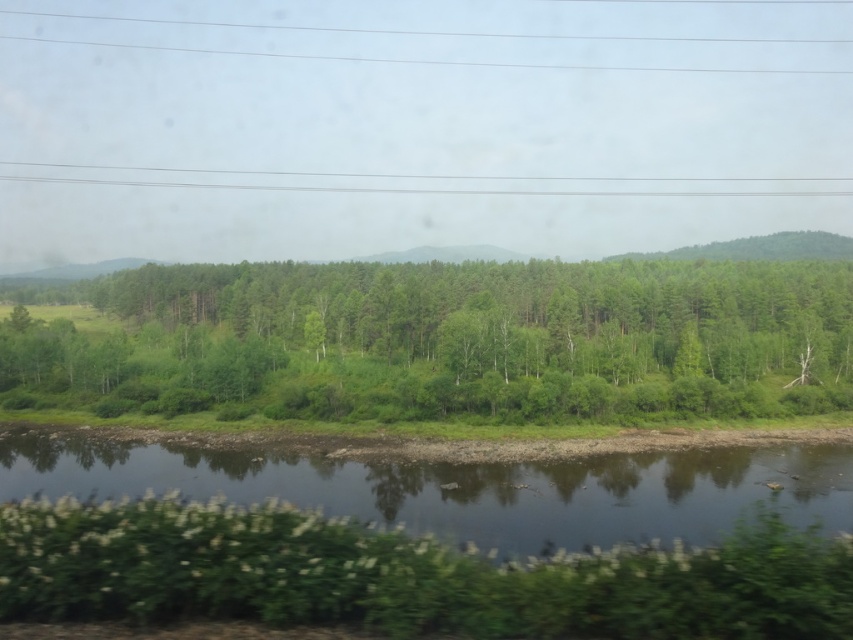
You are an environmental scientist assessing the scene. You need to determine which object has a smaller width between the green grassy river at lower center and the clear plastic power lines at upper center. Based on the scene, what is your conclusion?

The green grassy river at lower center is thinner than the clear plastic power lines at upper center, so the green grassy river at lower center has a smaller width.